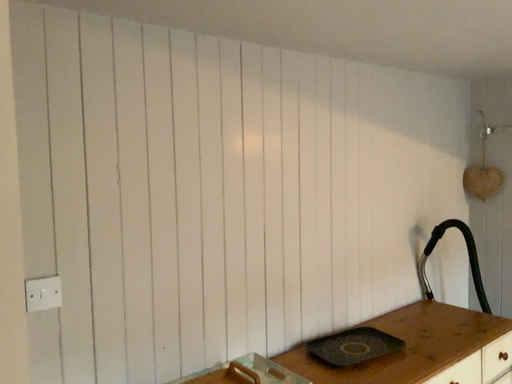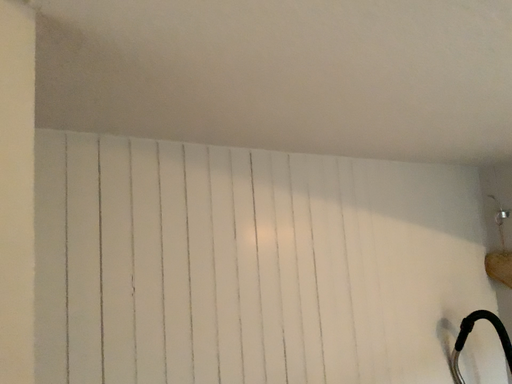
Question: How did the camera likely rotate when shooting the video?

Choices:
 (A) rotated downward
 (B) rotated upward

Answer: (B)